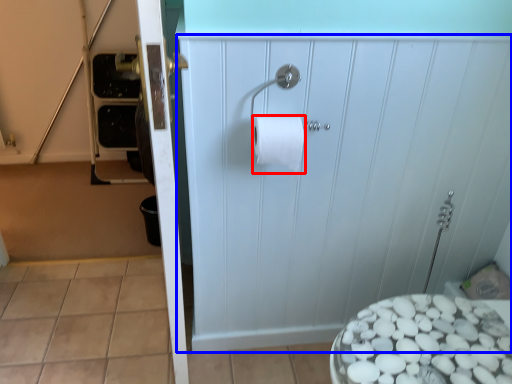
Question: Among these objects, which one is nearest to the camera, toilet paper (highlighted by a red box) or screen door (highlighted by a blue box)?

Choices:
 (A) toilet paper
 (B) screen door

Answer: (B)